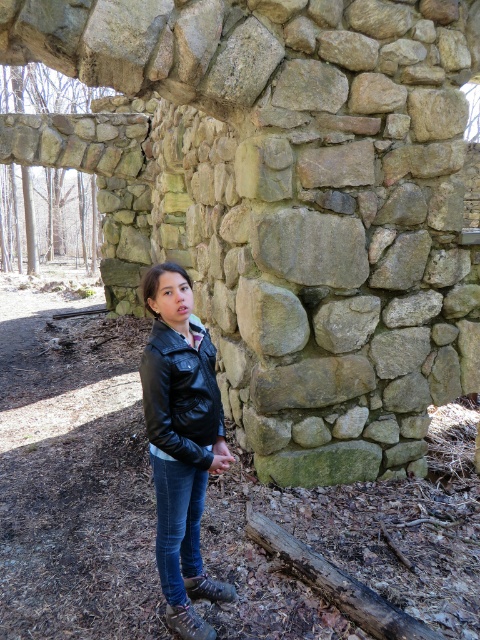
Question: Which of the following is the farthest from the observer?

Choices:
 (A) denim at lower center
 (B) brown rough wood at lower center

Answer: (B)

Question: Which object appears closest to the camera in this image?

Choices:
 (A) black leather jacket at center
 (B) denim at lower center

Answer: (A)

Question: Does black leather jacket at lower left come in front of denim at lower center?

Choices:
 (A) no
 (B) yes

Answer: (B)

Question: Can you confirm if black leather jacket at lower left is positioned to the right of brown rough wood at lower center?

Choices:
 (A) yes
 (B) no

Answer: (B)

Question: Does brown rough wood at lower center have a smaller size compared to denim at lower center?

Choices:
 (A) no
 (B) yes

Answer: (A)

Question: Based on their relative distances, which object is nearer to the black leather jacket at lower left?

Choices:
 (A) black leather jacket at center
 (B) denim at lower center

Answer: (A)